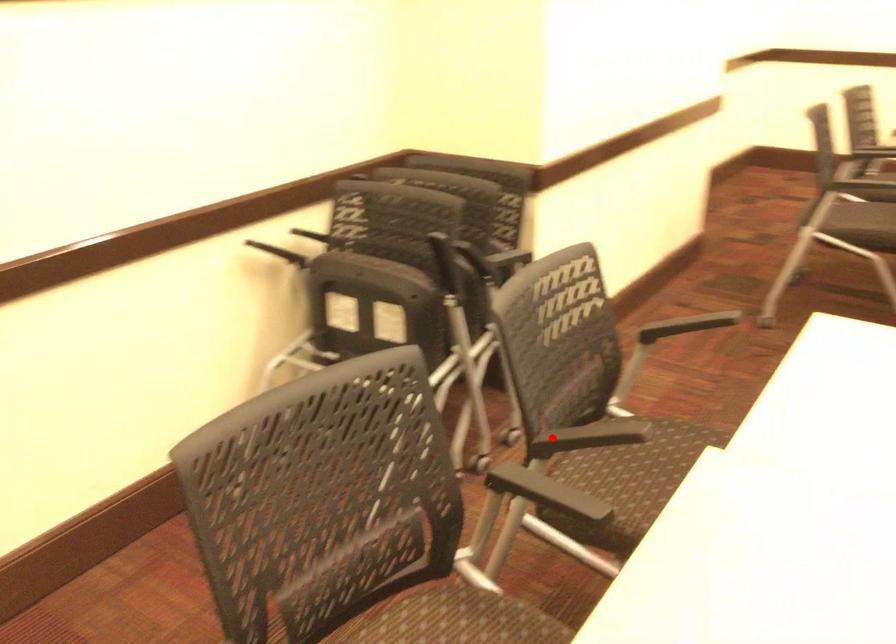
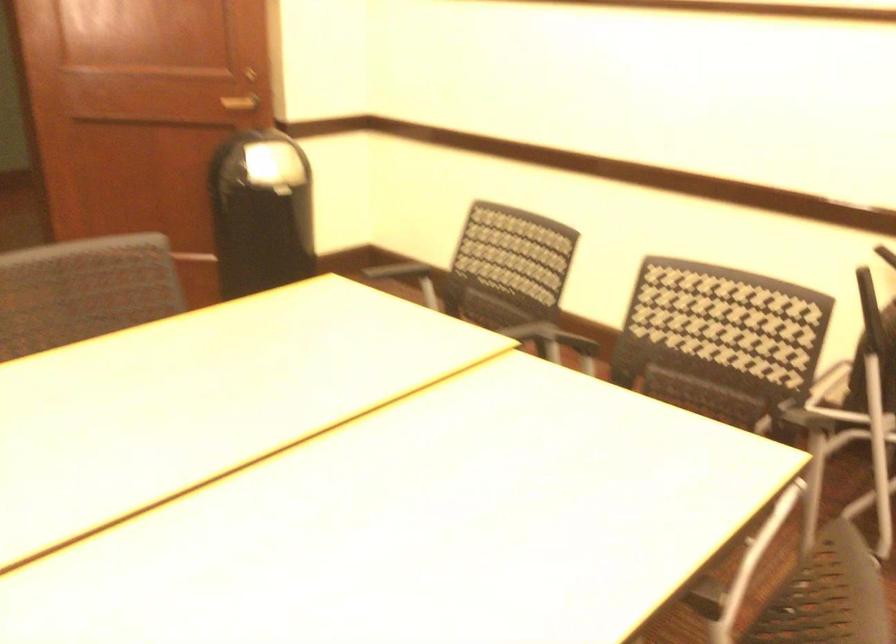
The point at the highlighted location is marked in the first image. Where is the corresponding point in the second image?

(652, 398)